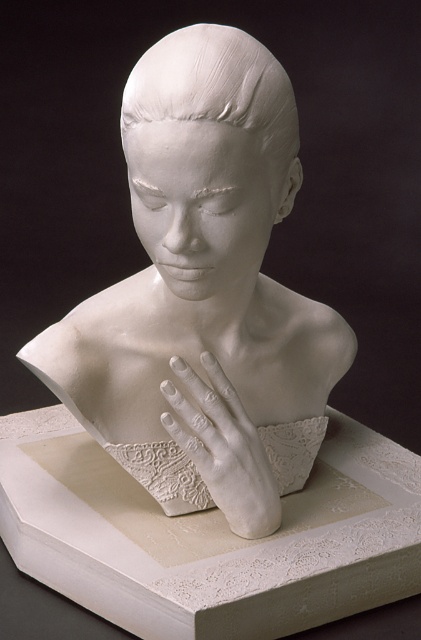
You are an art conservator examining the white plaster bust sculpture. You need to determine the relative size of the white matte bust at center and the white matte hand at center. Which one is taller?

The white matte bust at center is taller than the white matte hand at center according to the description.

You are an art conservator examining the sculpture. You notice a small crack at point [204,291]. Where exactly on the sculpture is this crack located?

The crack at point [204,291] is located on the white matte bust at center.

You are an art conservator examining the sculpture. You notice two points on the sculpture at coordinates point [125,120] and point [194,426]. Which point is nearer to your viewpoint as you look at the sculpture?

Point [125,120] is closer to the camera than point [194,426].